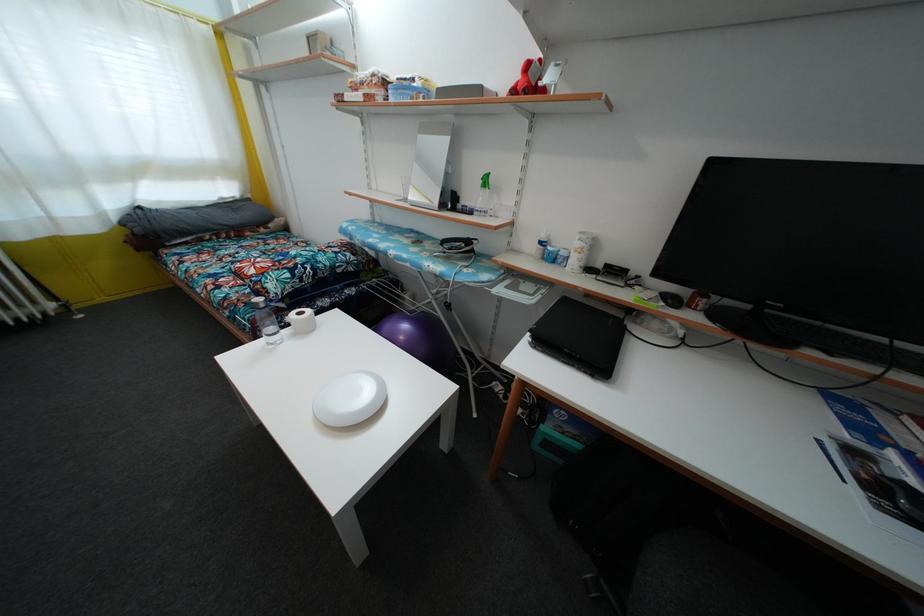
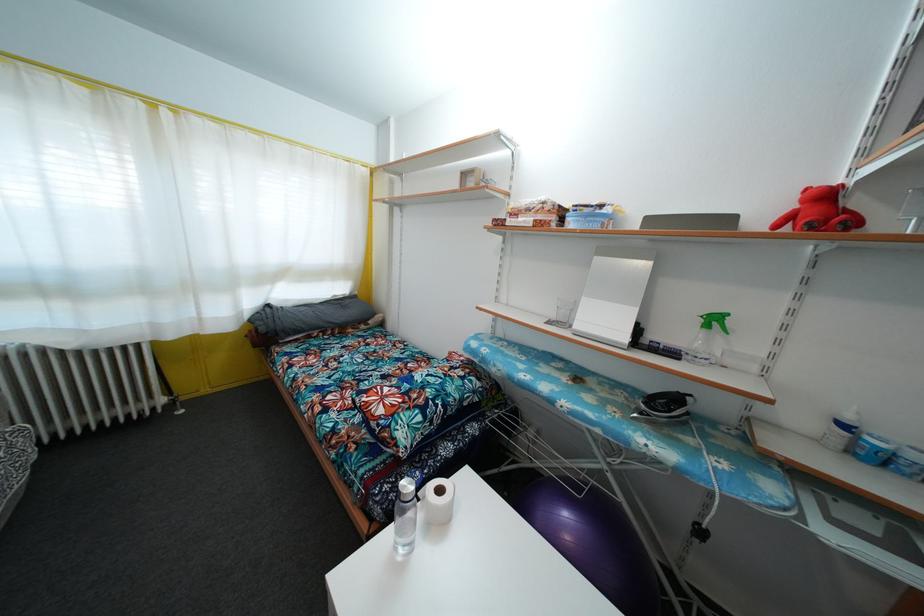
Find the pixel in the second image that matches the point at 418,86 in the first image.

(605, 213)